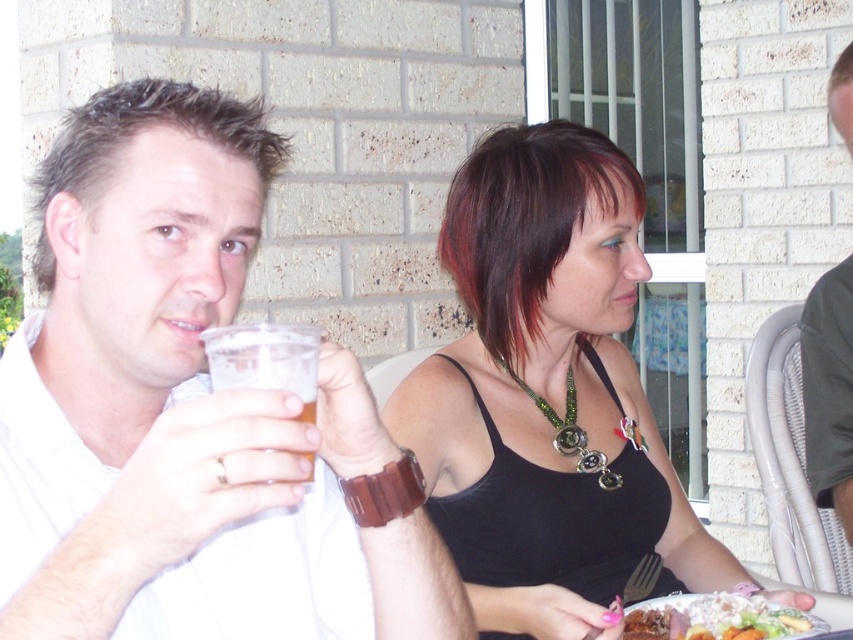
Question: Which of the following is the closest to the observer?

Choices:
 (A) clear plastic cup at upper center
 (B) dark gray fabric shirt at upper right
 (C) black fabric tank top at center

Answer: (A)

Question: Is white matte shirt at upper left smaller than clear plastic cup at upper center?

Choices:
 (A) yes
 (B) no

Answer: (B)

Question: Can you confirm if black fabric tank top at center is wider than dark gray fabric shirt at upper right?

Choices:
 (A) yes
 (B) no

Answer: (A)

Question: Is clear plastic cup at upper center thinner than white creamy mashed potatoes at lower right?

Choices:
 (A) yes
 (B) no

Answer: (A)

Question: Which of the following is the closest to the observer?

Choices:
 (A) dark gray fabric shirt at upper right
 (B) black fabric tank top at center
 (C) white matte shirt at upper left
 (D) clear plastic cup at upper center

Answer: (C)

Question: Estimate the real-world distances between objects in this image. Which object is closer to the clear plastic cup at upper center?

Choices:
 (A) black fabric tank top at center
 (B) white matte shirt at upper left
 (C) dark gray fabric shirt at upper right
 (D) white creamy mashed potatoes at lower right

Answer: (B)